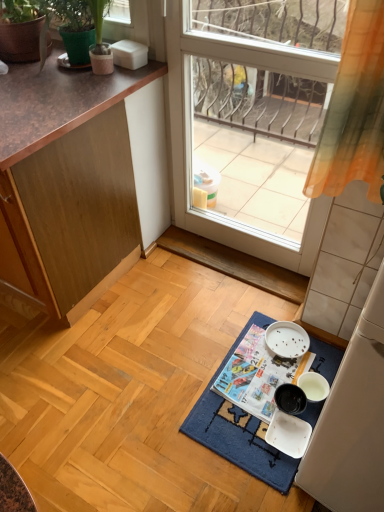
This screenshot has width=384, height=512. I want to click on vacant space behind blue woven bath mat at center, so click(215, 300).